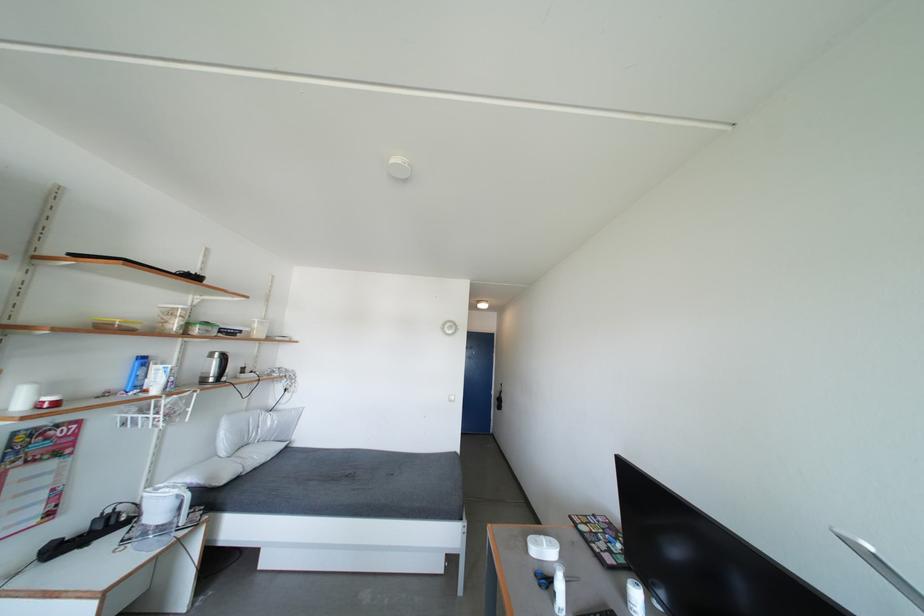
Describe the element at coordinates (599, 612) in the screenshot. I see `the black remote control` at that location.